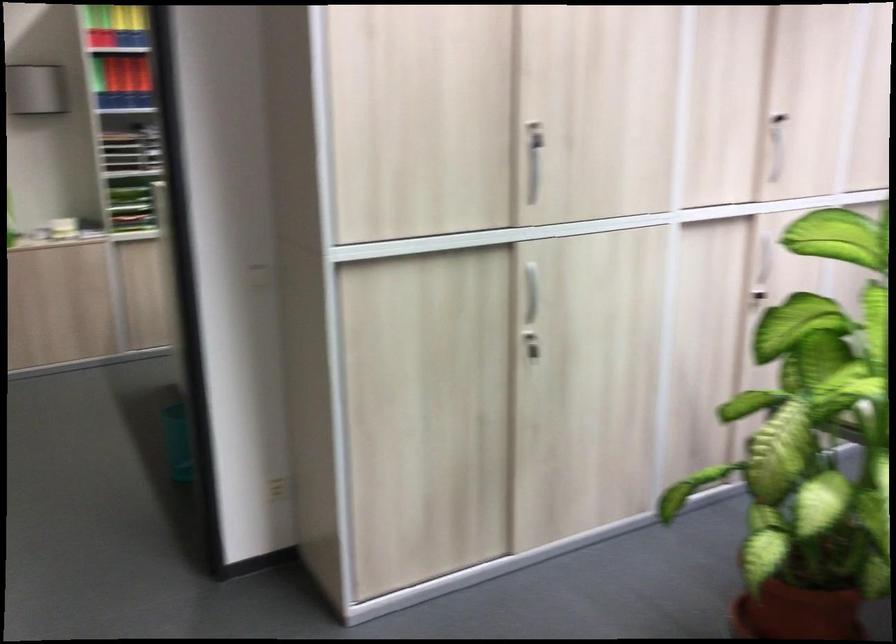
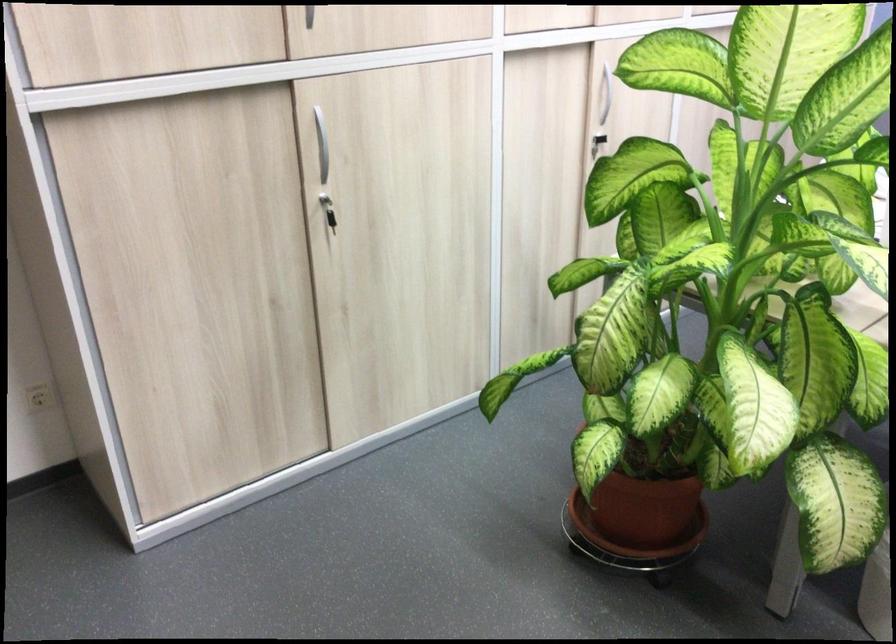
Locate, in the second image, the point that corresponds to [763,254] in the first image.

(606, 90)